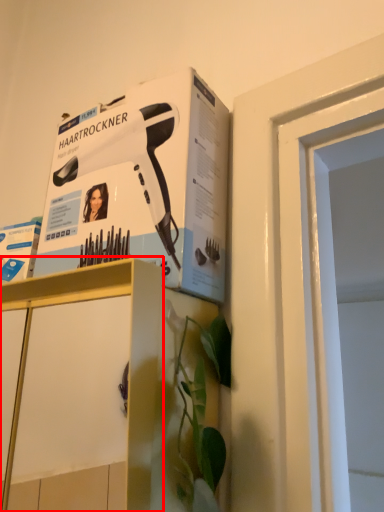
Question: From the image, what is the correct spatial relationship of cabinetry (annotated by the red box) in relation to paperback book?

Choices:
 (A) right
 (B) left

Answer: (B)